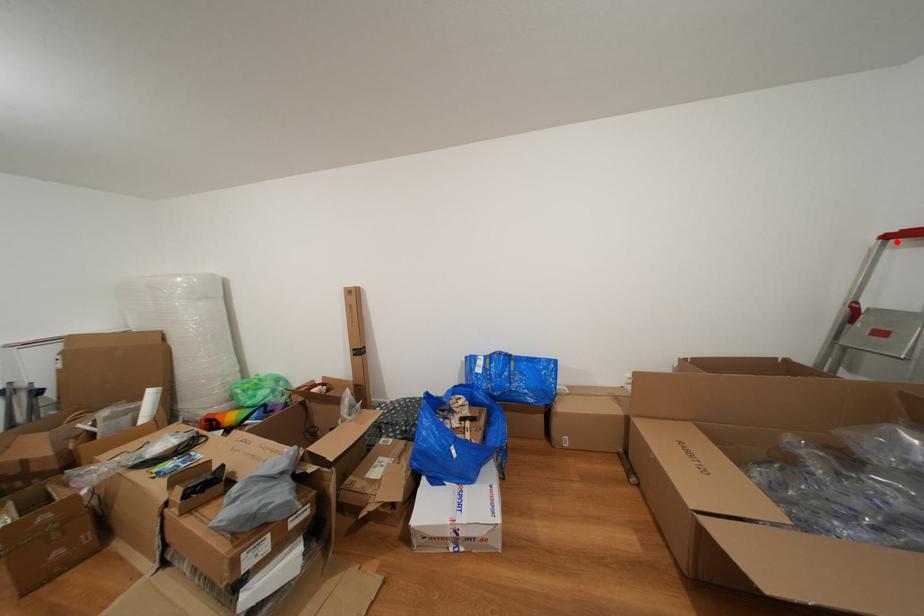
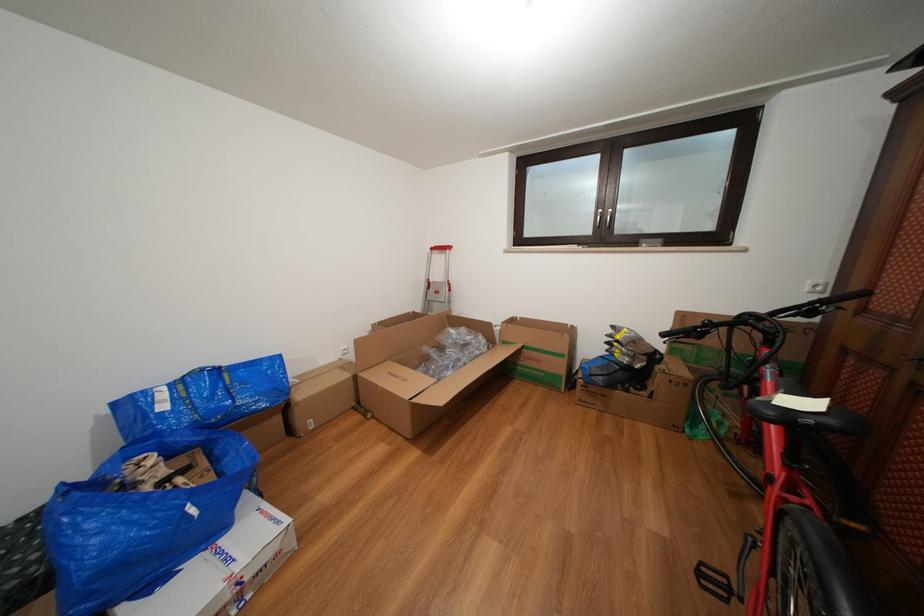
Locate, in the second image, the point that corresponds to the highlighted location in the first image.

(441, 254)